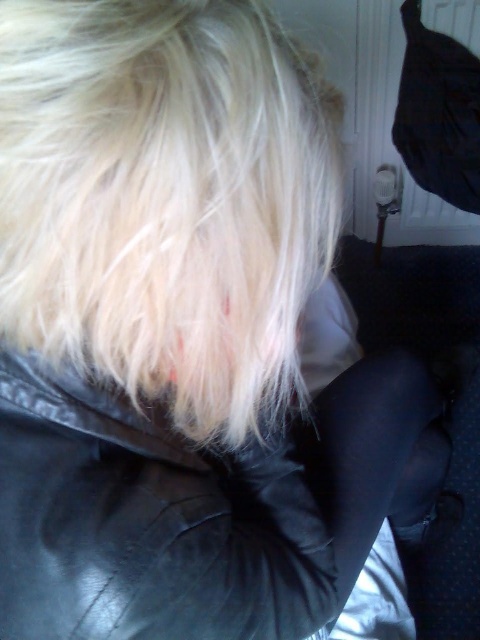
You are a photographer trying to capture the texture of the black leather jacket at center without including the blonde hair at upper center in the frame. Based on their positions, can you adjust your camera angle to achieve this?

The blonde hair at upper center is above the black leather jacket at center, so you can lower your camera angle to focus on the black leather jacket at center while avoiding the blonde hair at upper center in the frame.